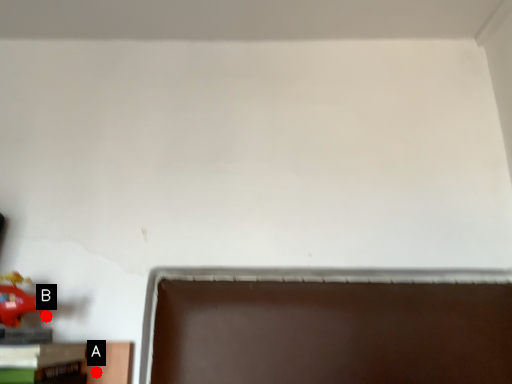
Question: Two points are circled on the image, labeled by A and B beside each circle. Which point is farther from the camera taking this photo?

Choices:
 (A) A is further
 (B) B is further

Answer: (A)